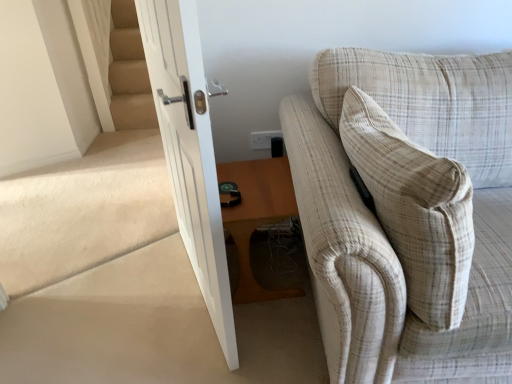
Locate an element on the screen. The height and width of the screenshot is (384, 512). vacant space underneath wooden table at lower center (from a real-world perspective) is located at coordinates (274, 268).